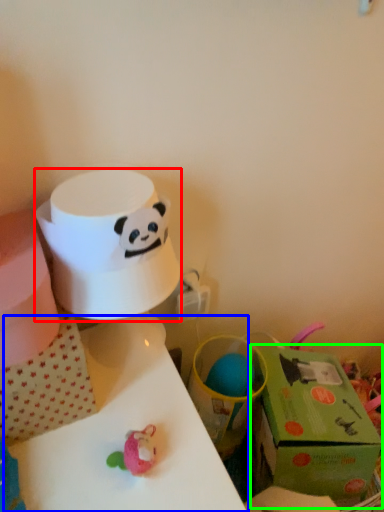
Question: Which is nearer to the paper towel (highlighted by a red box)? table (highlighted by a blue box) or gift box (highlighted by a green box).

Choices:
 (A) table
 (B) gift box

Answer: (A)